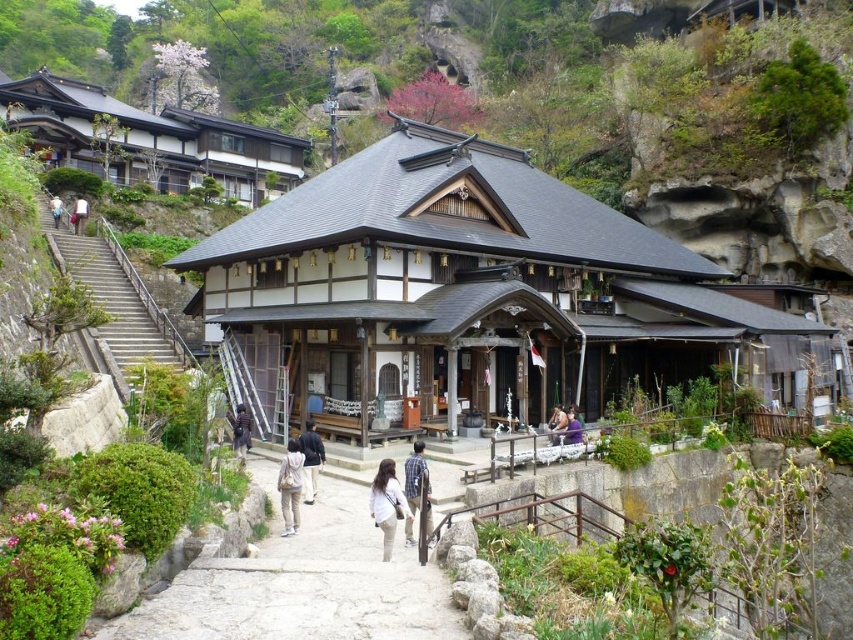
You are a photographer standing at the entrance of the traditional Japanese building. You see a striped fabric shirt at center and a white cotton shirt at upper left. Which shirt is nearer to you?

The striped fabric shirt at center is closer to the viewer than the white cotton shirt at upper left, so the striped fabric shirt at center is nearer to you.

You are standing at the entrance of the traditional Japanese building and see a light brown fabric pants at center and a white fabric bag at upper left. Which object is positioned to the right side from your perspective?

The light brown fabric pants at center is positioned to the right of the white fabric bag at upper left.

You are standing at the entrance of the traditional Japanese building and see two people wearing shirts. One is wearing a striped fabric shirt at center and the other a white cotton shirt at upper left. Which shirt is lower in position?

The striped fabric shirt at center is positioned under the white cotton shirt at upper left, so the striped fabric shirt at center is lower in position.